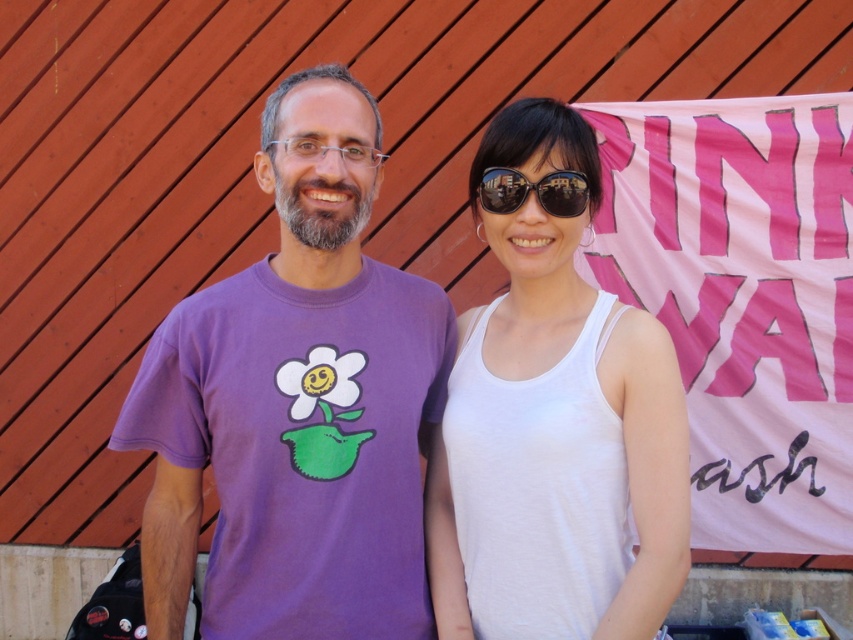
Question: Is purple cotton t-shirt at left positioned in front of white cotton tank top at center?

Choices:
 (A) yes
 (B) no

Answer: (B)

Question: Among these objects, which one is nearest to the camera?

Choices:
 (A) purple cotton t-shirt at left
 (B) sunglasses at center

Answer: (A)

Question: Among these objects, which one is farthest from the camera?

Choices:
 (A) purple cotton t-shirt at left
 (B) white cotton tank top at center

Answer: (A)

Question: Does white cotton tank top at center have a greater width compared to sunglasses at center?

Choices:
 (A) yes
 (B) no

Answer: (A)

Question: Among these objects, which one is nearest to the camera?

Choices:
 (A) sunglasses at center
 (B) white cotton tank top at center
 (C) purple cotton t-shirt at left

Answer: (B)

Question: In this image, where is purple cotton t-shirt at left located relative to white cotton tank top at center?

Choices:
 (A) left
 (B) right

Answer: (A)